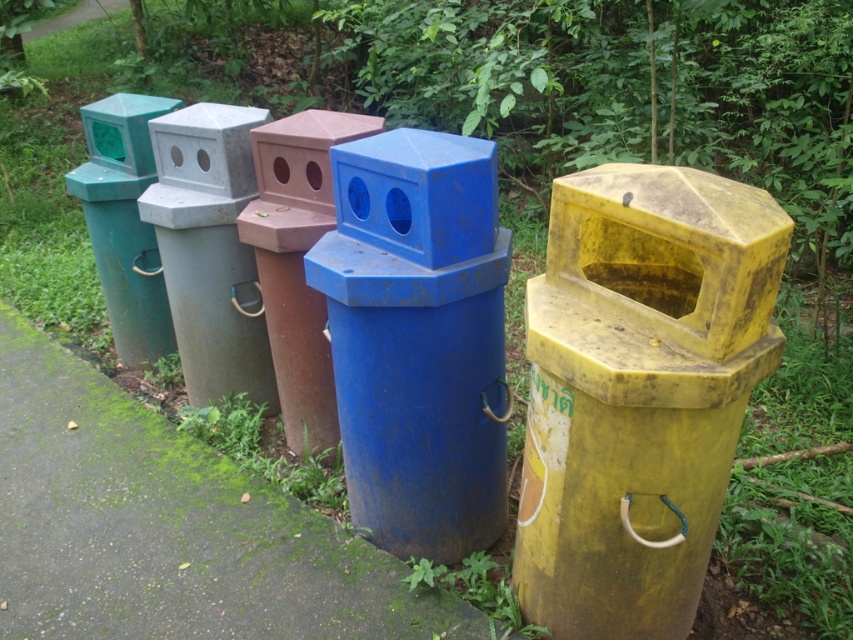
Question: Can you confirm if smooth concrete pavement at center is positioned above blue matte trash can at center?

Choices:
 (A) yes
 (B) no

Answer: (B)

Question: Which of these objects is positioned farthest from the smooth concrete pavement at center?

Choices:
 (A) matte green plastic trash can at left
 (B) blue matte trash can at center

Answer: (A)

Question: Is smooth concrete pavement at center bigger than matte green plastic trash can at left?

Choices:
 (A) yes
 (B) no

Answer: (A)

Question: Estimate the real-world distances between objects in this image. Which object is farther from the blue matte trash can at center?

Choices:
 (A) yellow matte trash can at center
 (B) smooth concrete pavement at center
 (C) matte green plastic trash can at left

Answer: (C)

Question: From the image, what is the correct spatial relationship of yellow matte trash can at center in relation to matte green plastic trash can at left?

Choices:
 (A) above
 (B) below

Answer: (B)

Question: Which point is closer to the camera taking this photo?

Choices:
 (A) (165, 541)
 (B) (369, 195)
 (C) (111, 211)
 (D) (756, 221)

Answer: (D)